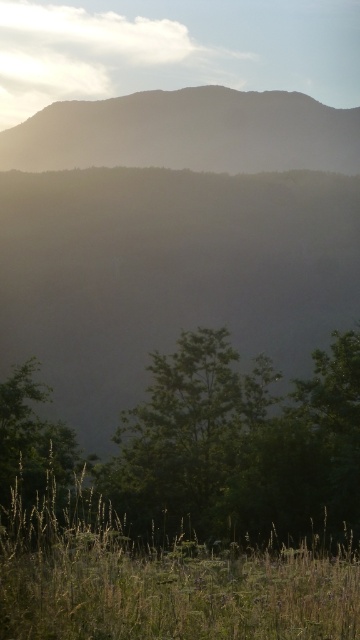
You are standing in the field of tall grasses and wildflowers and want to take a photo of both the silhouetted mountain at upper center and the green leafy tree at center. Which object will appear larger in the photo?

The silhouetted mountain at upper center will appear larger in the photo because it is taller than the green leafy tree at center.

Looking at this image, you are standing in the field of tall grasses and wildflowers. You see the dark brown mountain at upper center and the green leafy tree at lower left. Which object is higher in the sky?

The dark brown mountain at upper center is higher in the sky than the green leafy tree at lower left.

Consider the image. You are an artist sketching this landscape. You want to ensure the silhouetted mountain at upper center and the green leafy tree at center are proportionally accurate. Which object should you draw larger?

The silhouetted mountain at upper center should be drawn larger than the green leafy tree at center because it is bigger according to the description.